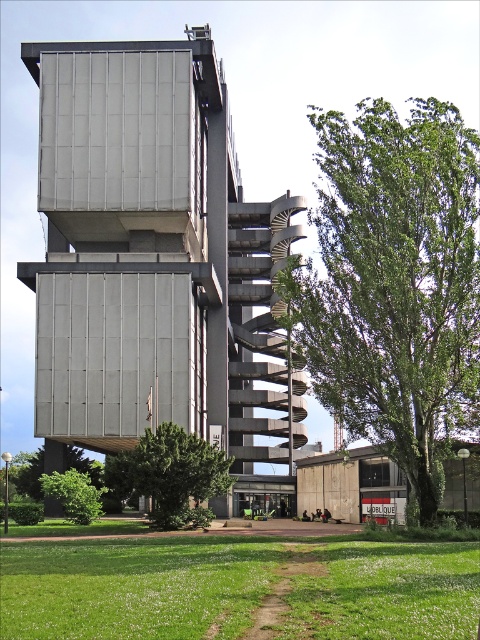
You are a landscape architect designing a walking path between the green leafy tree at center and the green leafy tree at lower left. The path must be 10 meters long. Will the path be long enough to connect the two trees?

The distance between the green leafy tree at center and the green leafy tree at lower left is 8.80 meters. Since the path is 10 meters long, it will be long enough to connect the two trees with some extra length remaining.